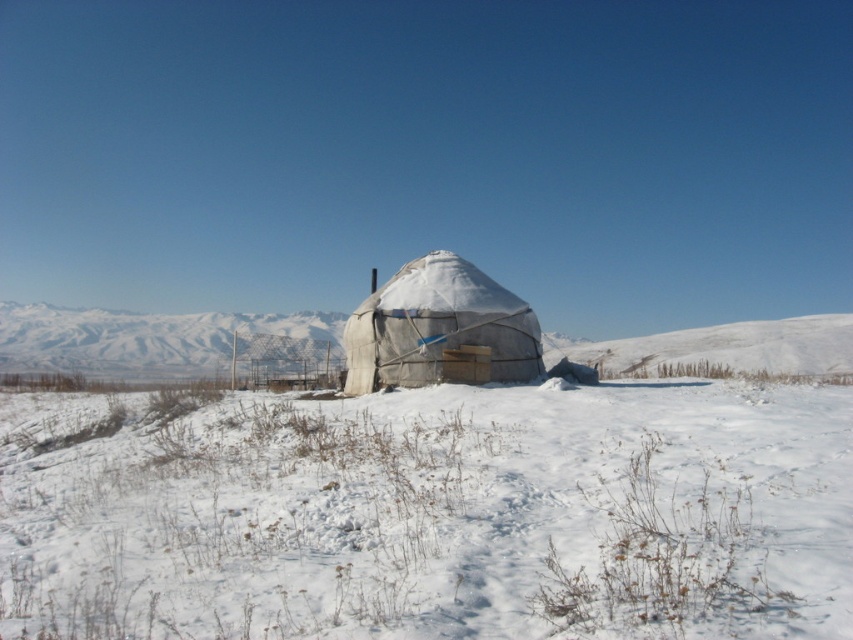
Is white snow-covered mountain at left wider than white fabric tent at center?

Indeed, white snow-covered mountain at left has a greater width compared to white fabric tent at center.

Who is higher up, white snow-covered mountain at left or white fabric tent at center?

white fabric tent at center

This screenshot has height=640, width=853. Describe the element at coordinates (152, 339) in the screenshot. I see `white snow-covered mountain at left` at that location.

The image size is (853, 640). I want to click on white snow-covered mountain at left, so click(152, 339).

Describe the element at coordinates (434, 515) in the screenshot. I see `white fluffy snow at center` at that location.

Can you confirm if white fluffy snow at center is taller than white fabric tent at center?

In fact, white fluffy snow at center may be shorter than white fabric tent at center.

Which is in front, point (103, 627) or point (451, 340)?

Point (103, 627) is in front.

You are a GUI agent. You are given a task and a screenshot of the screen. Output one action in this format:
    pyautogui.click(x=<x>, y=<y>)
    Task: Click on the white fluffy snow at center
    
    Given the screenshot: What is the action you would take?
    pyautogui.click(x=434, y=515)

Which is below, white fluffy snow at center or white snow-covered mountain at left?

white fluffy snow at center

Can you confirm if white fluffy snow at center is wider than white snow-covered mountain at left?

In fact, white fluffy snow at center might be narrower than white snow-covered mountain at left.

Does point (485, 470) come behind point (289, 339)?

No, it is not.

You are a GUI agent. You are given a task and a screenshot of the screen. Output one action in this format:
    pyautogui.click(x=<x>, y=<y>)
    Task: Click on the white fluffy snow at center
    
    Given the screenshot: What is the action you would take?
    pyautogui.click(x=434, y=515)